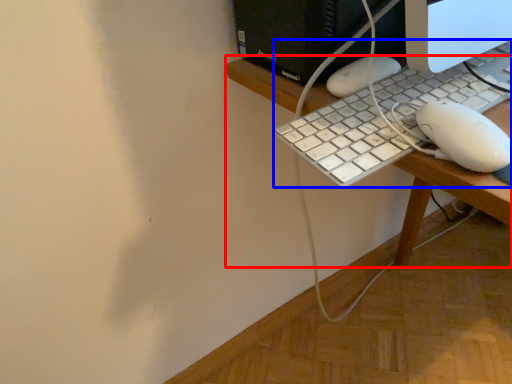
Question: Which object is further to the camera taking this photo, desk (highlighted by a red box) or computer keyboard (highlighted by a blue box)?

Choices:
 (A) desk
 (B) computer keyboard

Answer: (B)